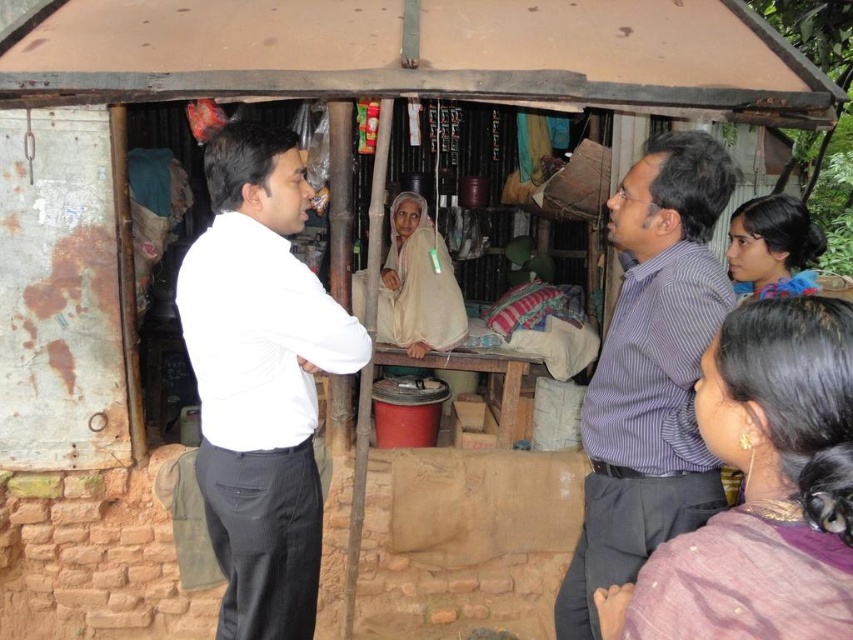
Between white smooth shirt at left and striped cotton shirt at center, which one has less height?

Standing shorter between the two is striped cotton shirt at center.

Can you confirm if white smooth shirt at left is thinner than striped cotton shirt at center?

Incorrect, white smooth shirt at left's width is not less than striped cotton shirt at center's.

Is point (210, 260) positioned after point (653, 362)?

Yes.

Image resolution: width=853 pixels, height=640 pixels. In order to click on white smooth shirt at left in this screenshot , I will do `click(260, 380)`.